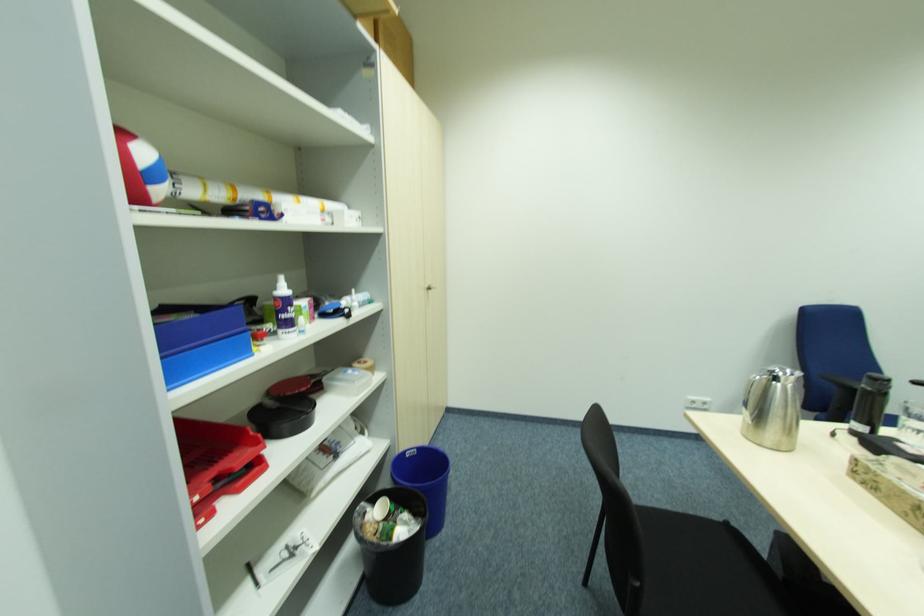
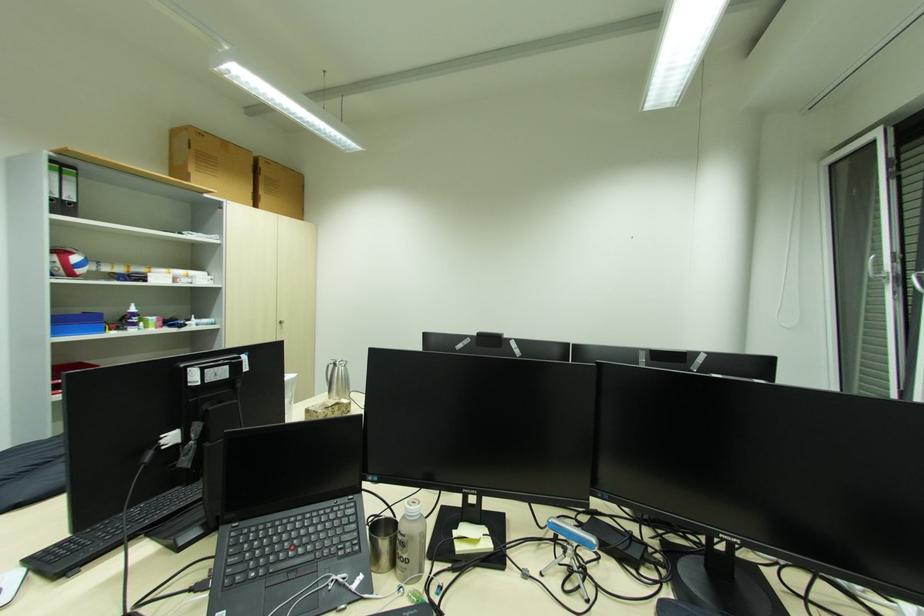
The images are taken continuously from a first-person perspective. In which direction are you moving?

The movement direction of the cameraman is right, backward.